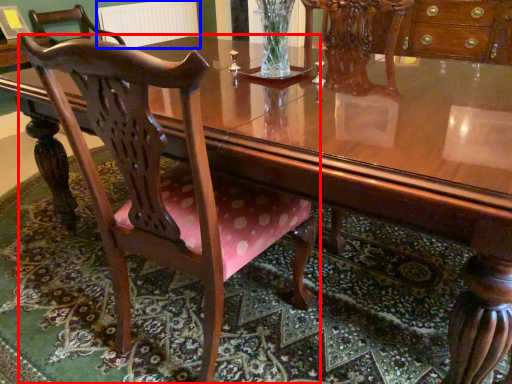
Question: Which object appears closest to the camera in this image, chair (highlighted by a red box) or radiator (highlighted by a blue box)?

Choices:
 (A) chair
 (B) radiator

Answer: (A)